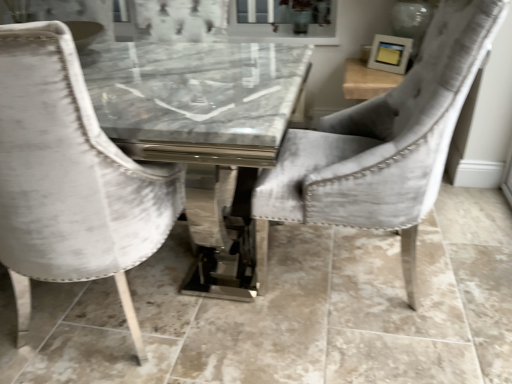
Locate an element on the screen. free space in front of velvet gray chair at center, which is counted as the 1th chair, starting from the right is located at coordinates (365, 345).